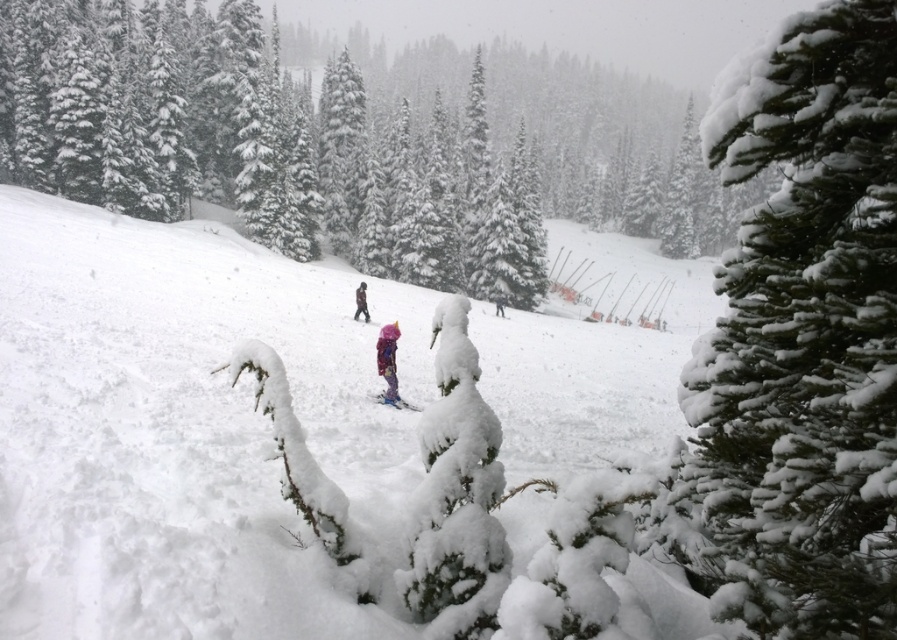
You are a hiker trying to decide which item to use to mark your path in the snow. You have a pink fabric at center and a matte blue ski at center. Based on their thickness, which item would be more effective for leaving a visible trail?

The matte blue ski at center is thicker than the pink fabric at center, so it would leave a more visible trail in the snow.

You are a hiker who needs to decide whether to take the pink fabric at center or the matte blue ski at center for shelter. Which item is larger and thus better suited for covering yourself?

The pink fabric at center is bigger than the matte blue ski at center, so it is better suited for covering yourself.